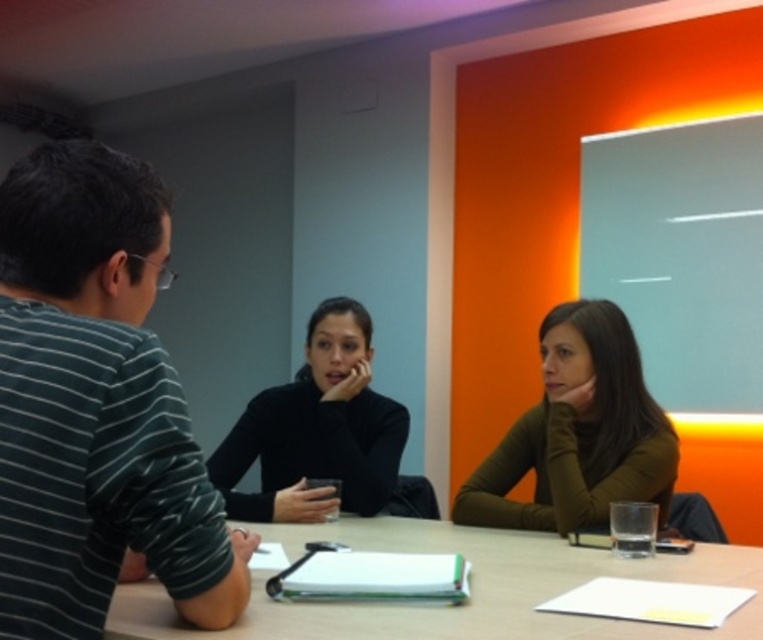
Question: Which of these objects is positioned closest to the matte green sweater at center?

Choices:
 (A) black matte turtleneck at center
 (B) smooth wooden table at center

Answer: (B)

Question: Does striped cotton shirt at left have a lesser width compared to matte green sweater at center?

Choices:
 (A) yes
 (B) no

Answer: (A)

Question: Can you confirm if matte green sweater at center is positioned to the right of black matte turtleneck at center?

Choices:
 (A) yes
 (B) no

Answer: (A)

Question: Which point is closer to the camera?

Choices:
 (A) black matte turtleneck at center
 (B) striped cotton shirt at left

Answer: (B)

Question: Which point is closer to the camera?

Choices:
 (A) (349, 404)
 (B) (649, 628)
 (C) (501, 445)

Answer: (B)

Question: Is smooth wooden table at center above black matte turtleneck at center?

Choices:
 (A) yes
 (B) no

Answer: (B)